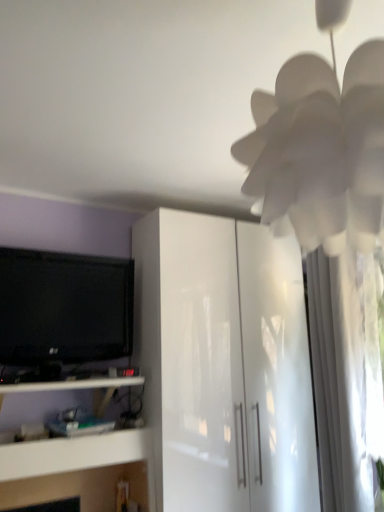
Question: Is white paper flower at upper right touching white glossy shelf at lower left?

Choices:
 (A) no
 (B) yes

Answer: (A)

Question: Is white paper flower at upper right outside of white glossy shelf at lower left?

Choices:
 (A) yes
 (B) no

Answer: (A)

Question: Does white paper flower at upper right have a greater height compared to white glossy shelf at lower left?

Choices:
 (A) yes
 (B) no

Answer: (A)

Question: Is white paper flower at upper right facing away from white glossy shelf at lower left?

Choices:
 (A) yes
 (B) no

Answer: (B)

Question: Does white paper flower at upper right lie in front of white glossy shelf at lower left?

Choices:
 (A) yes
 (B) no

Answer: (A)

Question: From a real-world perspective, is white paper flower at upper right above or below black glossy tv at left?

Choices:
 (A) above
 (B) below

Answer: (A)

Question: In terms of height, does white paper flower at upper right look taller or shorter compared to black glossy tv at left?

Choices:
 (A) short
 (B) tall

Answer: (A)

Question: Based on their positions, is white paper flower at upper right located to the left or right of black glossy tv at left?

Choices:
 (A) right
 (B) left

Answer: (A)

Question: Considering the positions of point pyautogui.click(x=291, y=93) and point pyautogui.click(x=14, y=257), is point pyautogui.click(x=291, y=93) closer or farther from the camera than point pyautogui.click(x=14, y=257)?

Choices:
 (A) farther
 (B) closer

Answer: (B)

Question: Relative to glossy white cabinet at center, is white glossy shelf at lower left in front or behind?

Choices:
 (A) front
 (B) behind

Answer: (A)

Question: Is point (46, 381) positioned closer to the camera than point (201, 508)?

Choices:
 (A) closer
 (B) farther

Answer: (B)

Question: In terms of height, does white glossy shelf at lower left look taller or shorter compared to glossy white cabinet at center?

Choices:
 (A) tall
 (B) short

Answer: (B)

Question: Considering the positions of white glossy shelf at lower left and glossy white cabinet at center in the image, is white glossy shelf at lower left bigger or smaller than glossy white cabinet at center?

Choices:
 (A) small
 (B) big

Answer: (A)

Question: Would you say white glossy shelf at lower left is inside or outside black glossy tv at left?

Choices:
 (A) outside
 (B) inside

Answer: (A)

Question: From the image's perspective, relative to black glossy tv at left, is white glossy shelf at lower left above or below?

Choices:
 (A) above
 (B) below

Answer: (B)